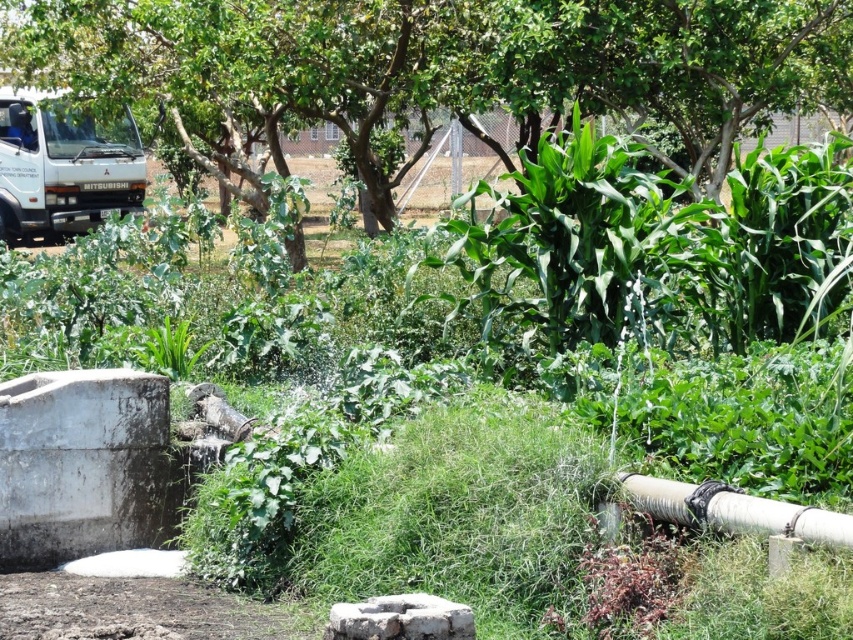
Looking at this image, you are a gardener standing in the garden. You see the green leafy tree at upper center and the white matte truck at upper left. Which object is closer to you?

The white matte truck at upper left is closer to you because the green leafy tree at upper center is positioned under it, indicating it is further away.

You are a gardener standing at the base of the green leafy tree at upper center. You need to reach a water tank located behind you. The garden path is narrow. Can you walk straight back without hitting the water tank?

The distance between you and the water tank is 10.25 meters, so you can walk straight back without any issue as there is enough space between you and the water tank.